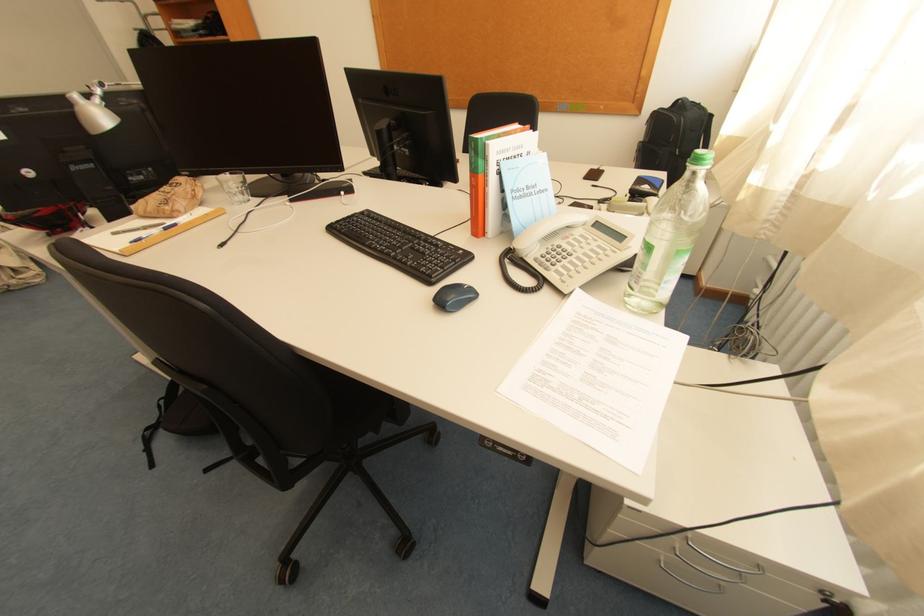
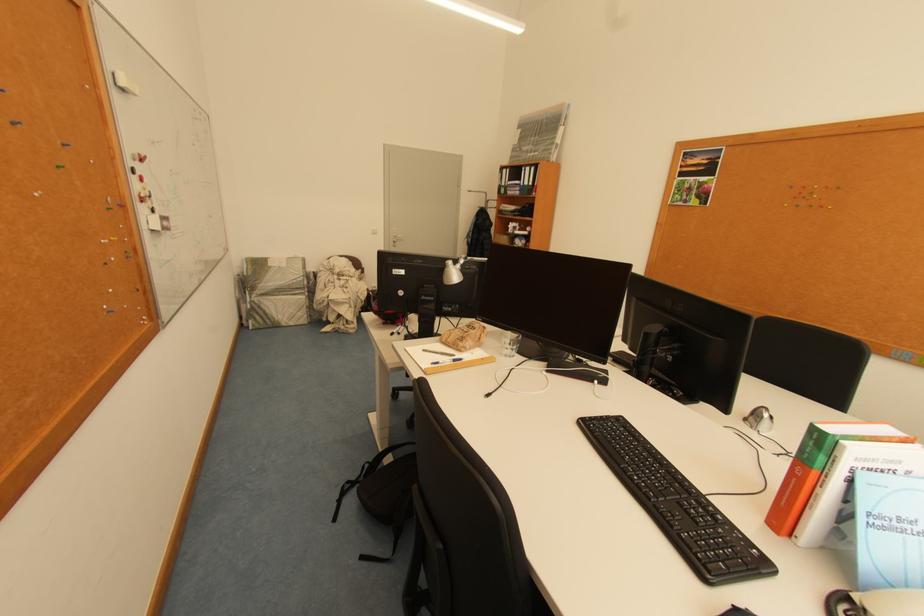
In the second image, find the point that corresponds to (482,211) in the first image.

(793, 501)